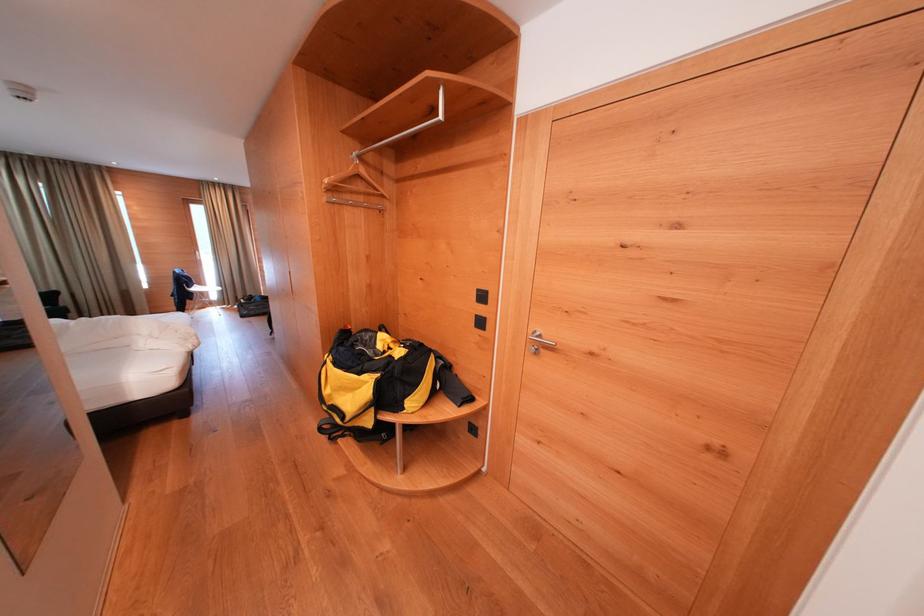
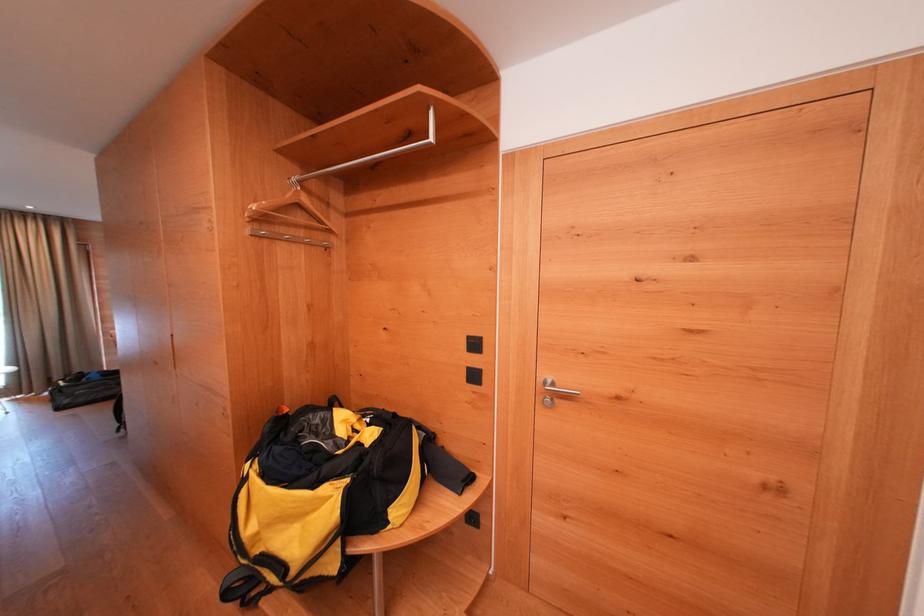
Question: The first image is from the beginning of the video and the second image is from the end. How did the camera likely rotate when shooting the video?

Choices:
 (A) Left
 (B) Right
 (C) Up
 (D) Down

Answer: (B)